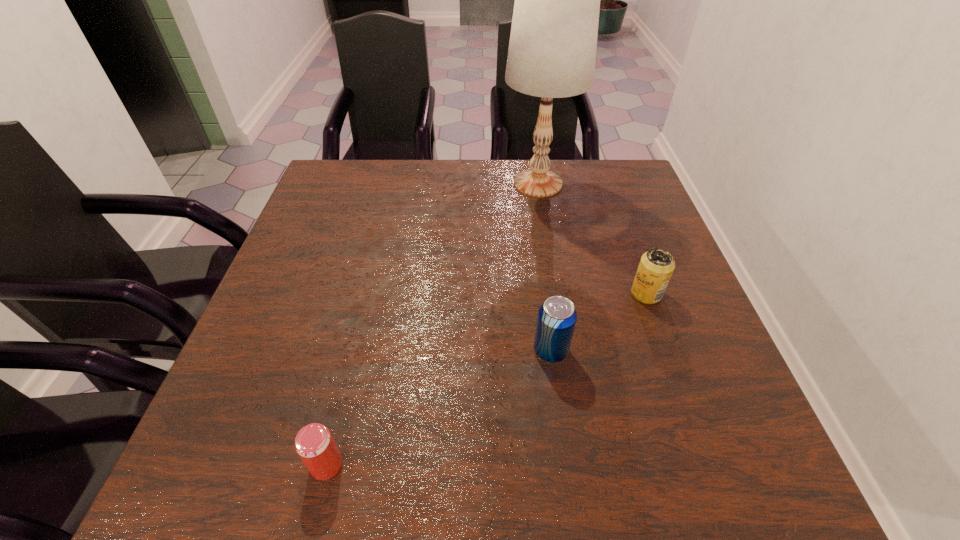
Find the location of a particular element. The width and height of the screenshot is (960, 540). free space located 0.090m on the front of the farthest beer can is located at coordinates (662, 338).

At what (x,y) coordinates should I click in order to perform the action: click on vacant area located 0.170m on the left of the leftmost object. Please return your answer as a coordinate pair (x, y). This screenshot has width=960, height=540. Looking at the image, I should click on (205, 465).

Identify the location of object that is at the far edge. (552, 50).

I want to click on object at the near edge, so click(314, 444).

Locate an element on the screen. object that is at the right edge is located at coordinates (656, 266).

You are a GUI agent. You are given a task and a screenshot of the screen. Output one action in this format:
    pyautogui.click(x=<x>, y=<y>)
    Task: Click on the blank space at the far edge
    Image resolution: width=960 pixels, height=540 pixels.
    Given the screenshot: What is the action you would take?
    pyautogui.click(x=520, y=164)

This screenshot has width=960, height=540. What are the coordinates of `vacant space at the near edge` in the screenshot? It's located at (347, 496).

The width and height of the screenshot is (960, 540). I want to click on vacant region at the left edge of the desktop, so click(x=236, y=407).

This screenshot has height=540, width=960. I want to click on vacant space at the right edge of the desktop, so click(699, 302).

Find the location of a particular element. free region at the near left corner is located at coordinates (266, 487).